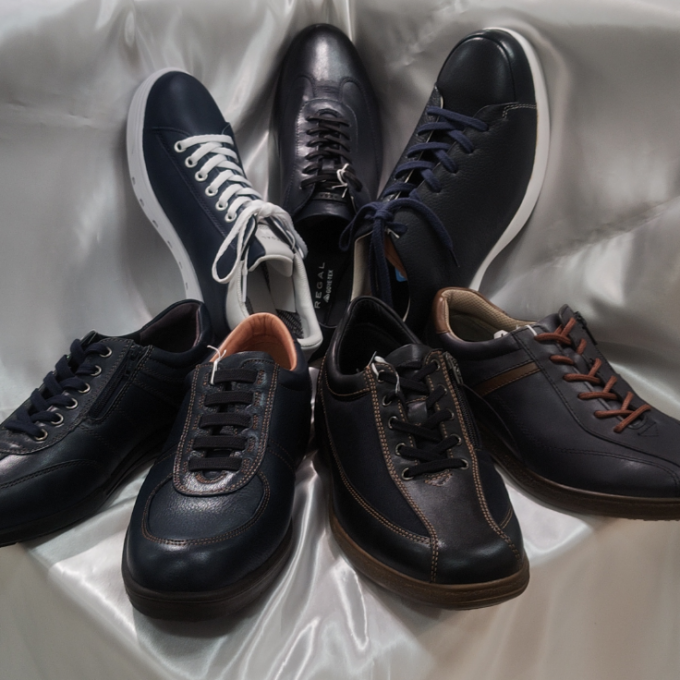
This screenshot has width=680, height=680. Find the location of `leather`. leather is located at coordinates (547, 405), (373, 460), (269, 487), (122, 422), (503, 201), (372, 137), (194, 207).